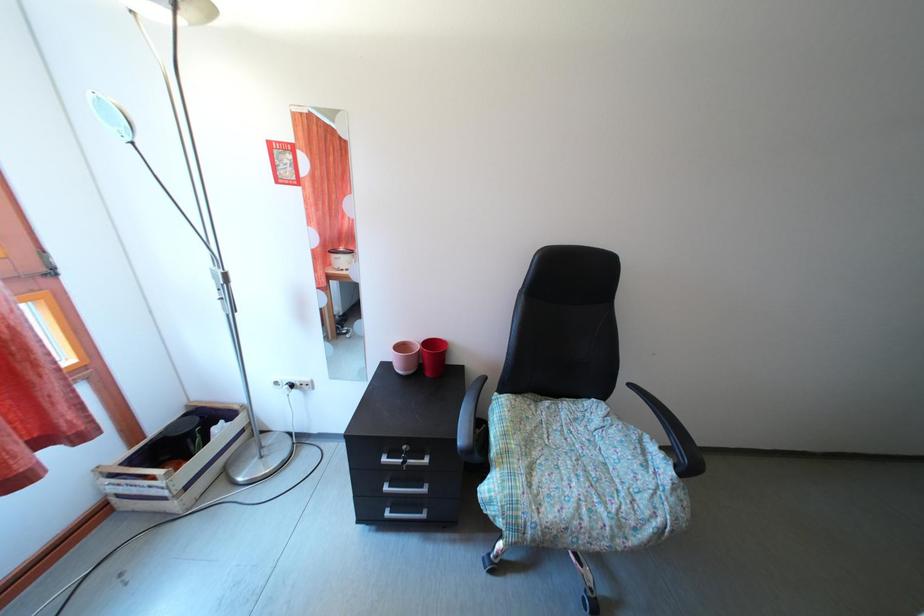
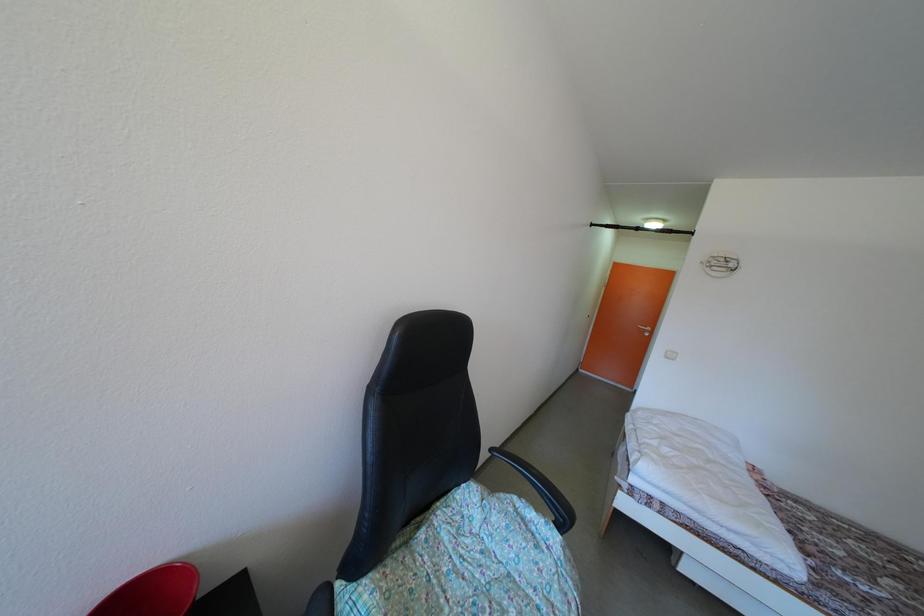
Question: Based on the continuous images, in which direction is the camera rotating? Reply with the corresponding letter.

Choices:
 (A) Left
 (B) Right
 (C) Up
 (D) Down

Answer: (B)